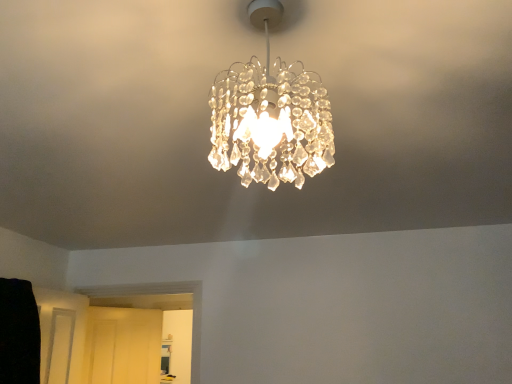
Question: From the image's perspective, is matte white door at lower left located above or below clear crystal chandelier at center?

Choices:
 (A) below
 (B) above

Answer: (A)

Question: From their relative heights in the image, would you say matte white door at lower left is taller or shorter than clear crystal chandelier at center?

Choices:
 (A) tall
 (B) short

Answer: (A)

Question: Looking at the image, does matte white door at lower left seem bigger or smaller compared to clear crystal chandelier at center?

Choices:
 (A) big
 (B) small

Answer: (A)

Question: In terms of size, does clear crystal chandelier at center appear bigger or smaller than matte white door at lower left?

Choices:
 (A) big
 (B) small

Answer: (B)

Question: Would you say clear crystal chandelier at center is inside or outside matte white door at lower left?

Choices:
 (A) outside
 (B) inside

Answer: (A)

Question: Is clear crystal chandelier at center taller or shorter than matte white door at lower left?

Choices:
 (A) short
 (B) tall

Answer: (A)

Question: In terms of width, does clear crystal chandelier at center look wider or thinner when compared to matte white door at lower left?

Choices:
 (A) thin
 (B) wide

Answer: (B)